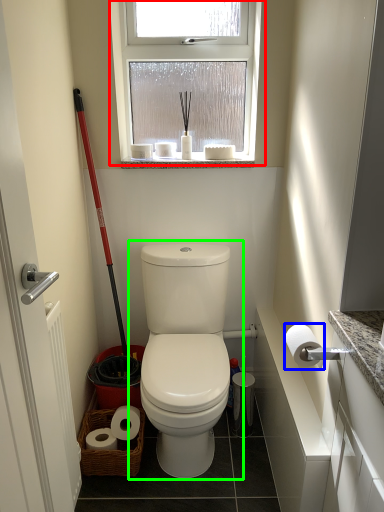
Question: Which is nearer to the window (highlighted by a red box)? toilet paper (highlighted by a blue box) or toilet (highlighted by a green box).

Choices:
 (A) toilet paper
 (B) toilet

Answer: (B)